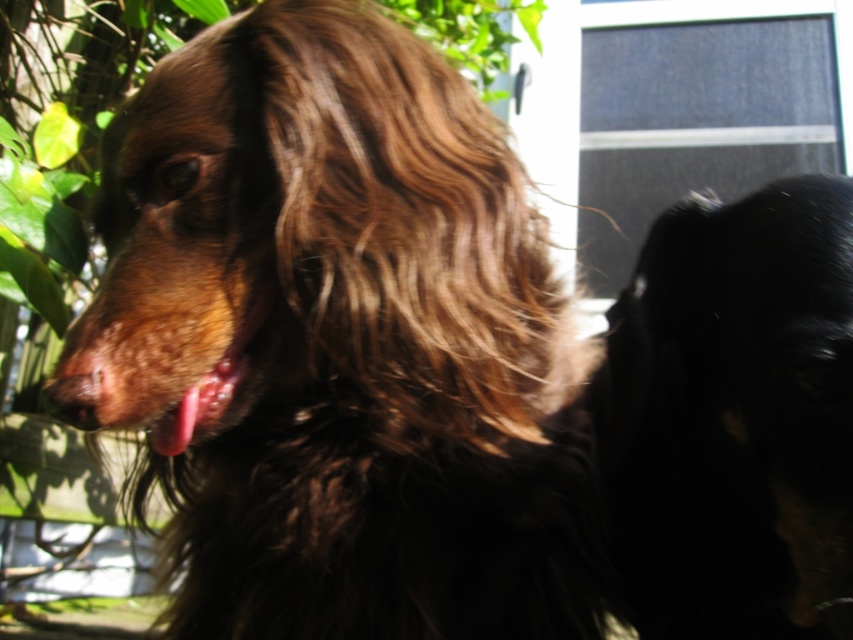
Question: Which object appears farthest from the camera in this image?

Choices:
 (A) black fur dog at right
 (B) brown furry dog at left
 (C) pink glossy tongue at center

Answer: (C)

Question: Is black fur dog at right positioned behind brown fuzzy nose at center?

Choices:
 (A) yes
 (B) no

Answer: (B)

Question: Which point is farther from the camera taking this photo?

Choices:
 (A) (471, 388)
 (B) (759, 92)
 (C) (792, 196)

Answer: (B)

Question: Is brown furry dog at left bigger than brown fuzzy nose at center?

Choices:
 (A) yes
 (B) no

Answer: (A)

Question: From the image, what is the correct spatial relationship of brown furry dog at left in relation to blue fabric screen door at upper right?

Choices:
 (A) below
 (B) above

Answer: (A)

Question: Among these points, which one is nearest to the camera?

Choices:
 (A) (181, 404)
 (B) (256, 636)

Answer: (A)